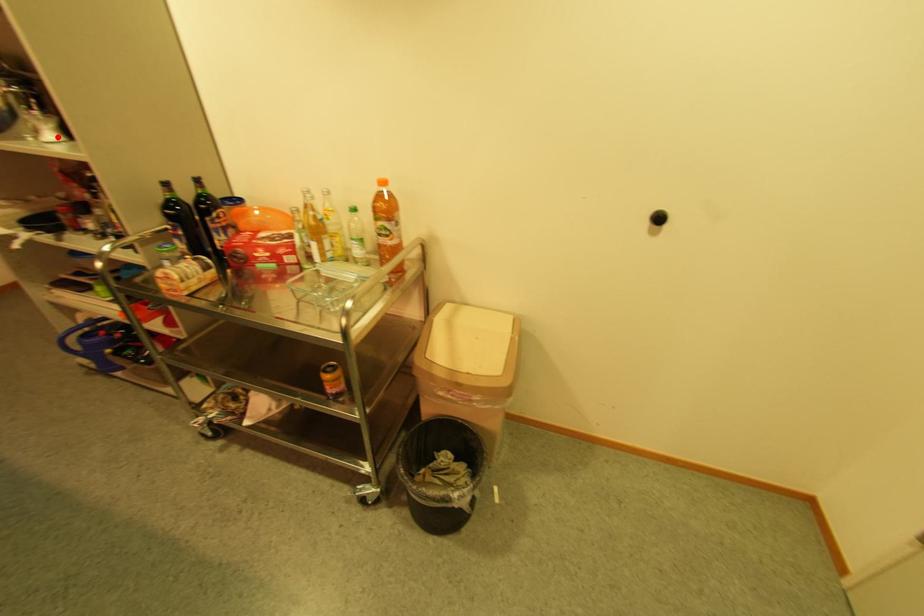
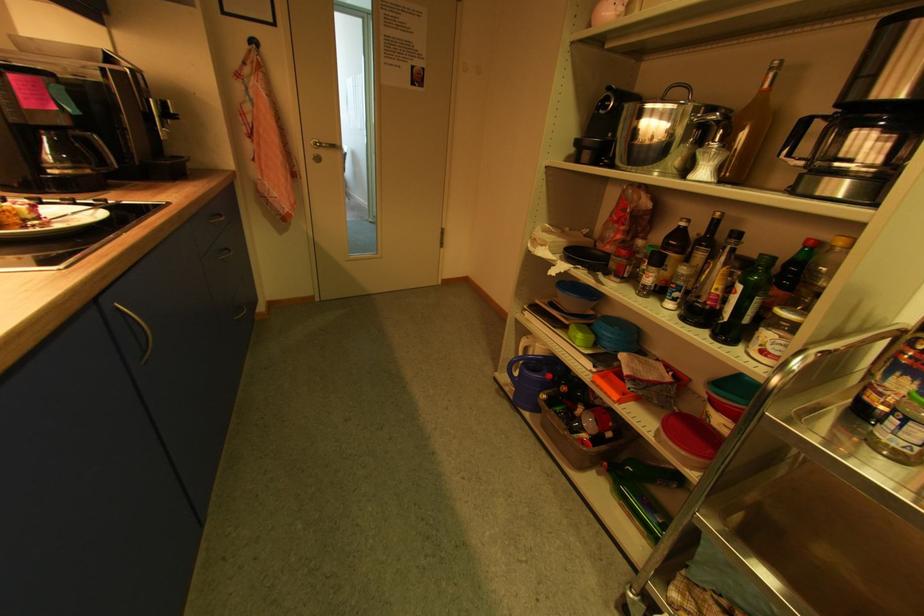
Question: I am providing you with two images of the same scene from different viewpoints. Given a red point in image1, look at the same physical point in image2. Is it:

Choices:
 (A) Closer to the viewpoint
 (B) Farther from the viewpoint

Answer: (A)